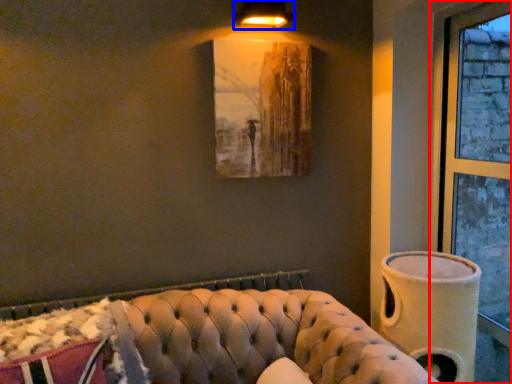
Question: Which object is further to the camera taking this photo, window (highlighted by a red box) or lamp (highlighted by a blue box)?

Choices:
 (A) window
 (B) lamp

Answer: (B)